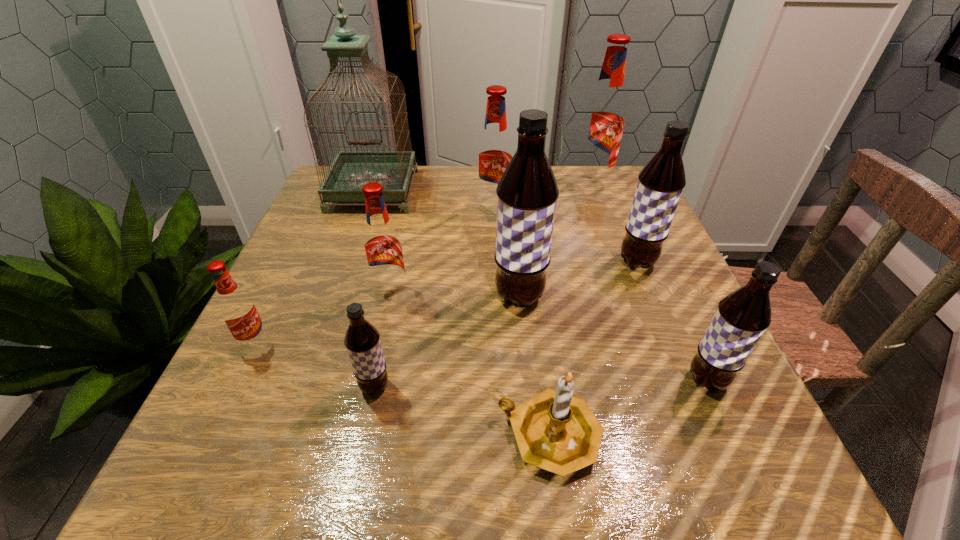
Find the location of a particular element. The image size is (960, 540). greenish birdcage is located at coordinates (350, 170).

You are a GUI agent. You are given a task and a screenshot of the screen. Output one action in this format:
    pyautogui.click(x=<x>, y=<y>)
    Task: Click on the tallest object
    This screenshot has height=540, width=960.
    Given the screenshot: What is the action you would take?
    pyautogui.click(x=350, y=170)

Find the location of a particular element. the biggest brown root beer is located at coordinates (527, 193).

Image resolution: width=960 pixels, height=540 pixels. What are the coordinates of `the second farthest brown root beer` in the screenshot? It's located at (527, 193).

I want to click on the rightmost red root beer, so click(603, 122).

What are the coordinates of `the biggest red root beer` in the screenshot? It's located at (603, 122).

Where is `the third nearest red root beer`? This screenshot has height=540, width=960. the third nearest red root beer is located at coordinates (494, 153).

Locate an element on the screen. the second farthest root beer is located at coordinates (494, 153).

This screenshot has width=960, height=540. Identify the location of the second biggest brown root beer. (660, 183).

Identify the location of the farthest brown root beer. pos(660,183).